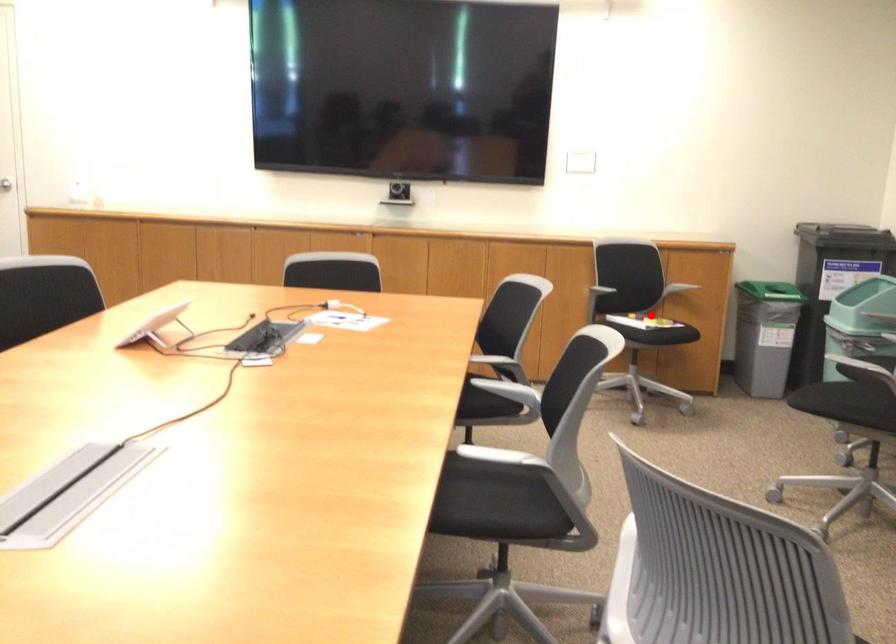
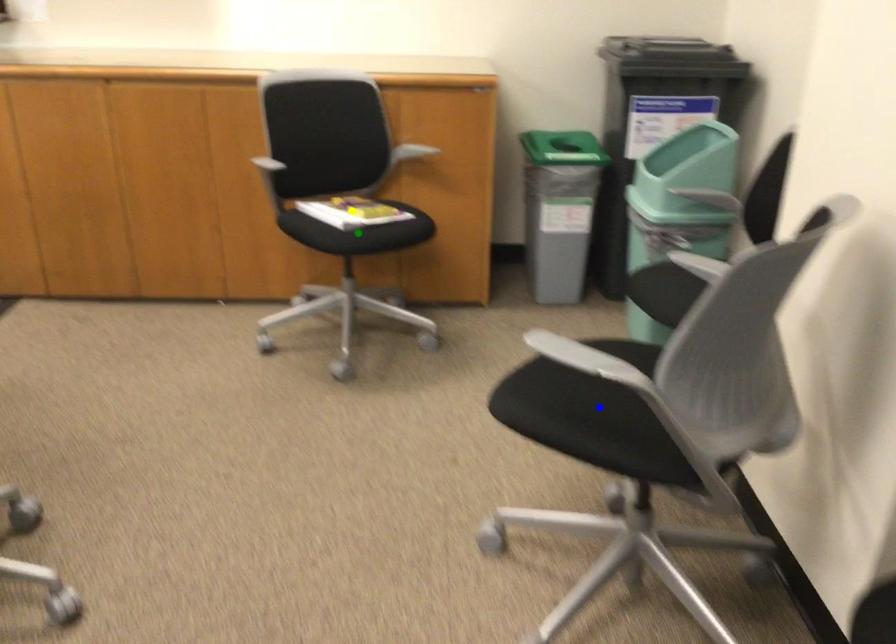
Question: I am providing you with two images of the same scene from different viewpoints. A red point is marked on the first image. You are given multiple points on the second image. Which spot in image 2 lines up with the point in image 1?

Choices:
 (A) blue point
 (B) green point
 (C) yellow point

Answer: (B)